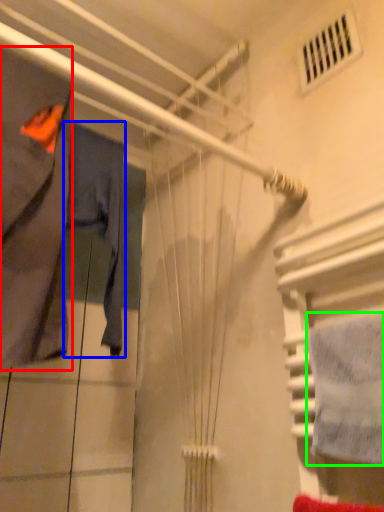
Question: Considering the real-world distances, which object is closest to clothing (highlighted by a red box)? clothing (highlighted by a blue box) or towel (highlighted by a green box).

Choices:
 (A) clothing
 (B) towel

Answer: (A)